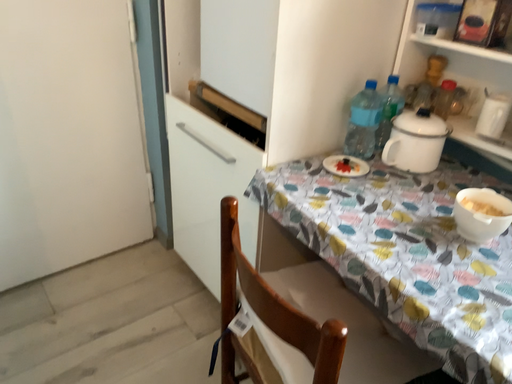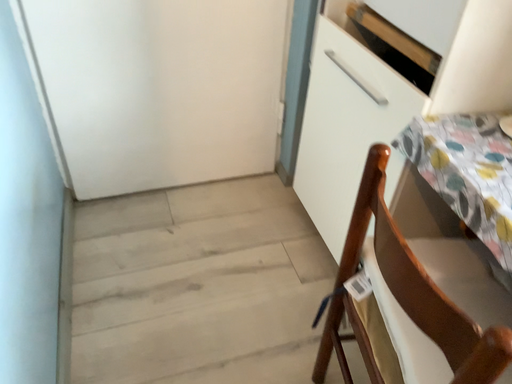
Question: Which way did the camera rotate in the video?

Choices:
 (A) rotated left
 (B) rotated right

Answer: (A)